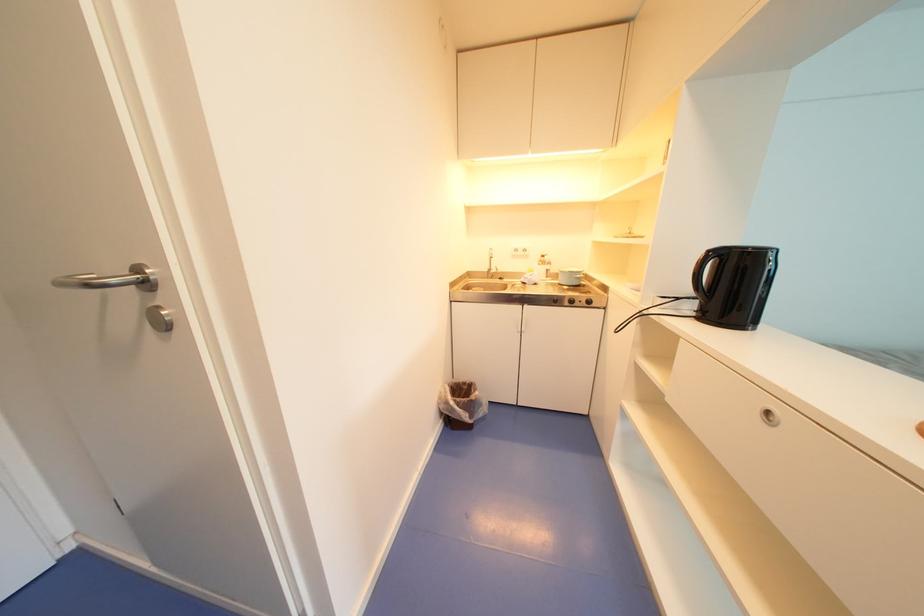
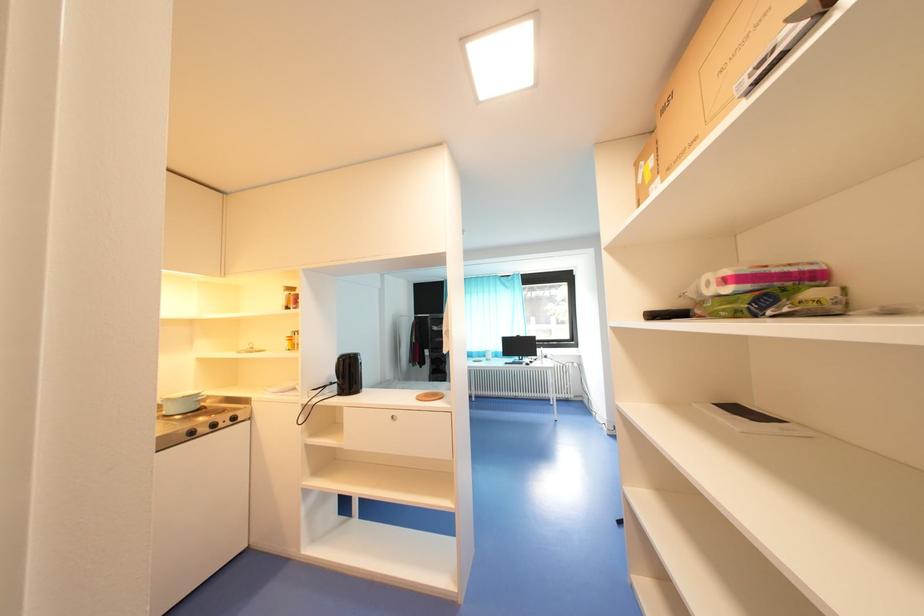
Question: How did the camera likely rotate?

Choices:
 (A) Left
 (B) Right
 (C) Up
 (D) Down

Answer: (B)